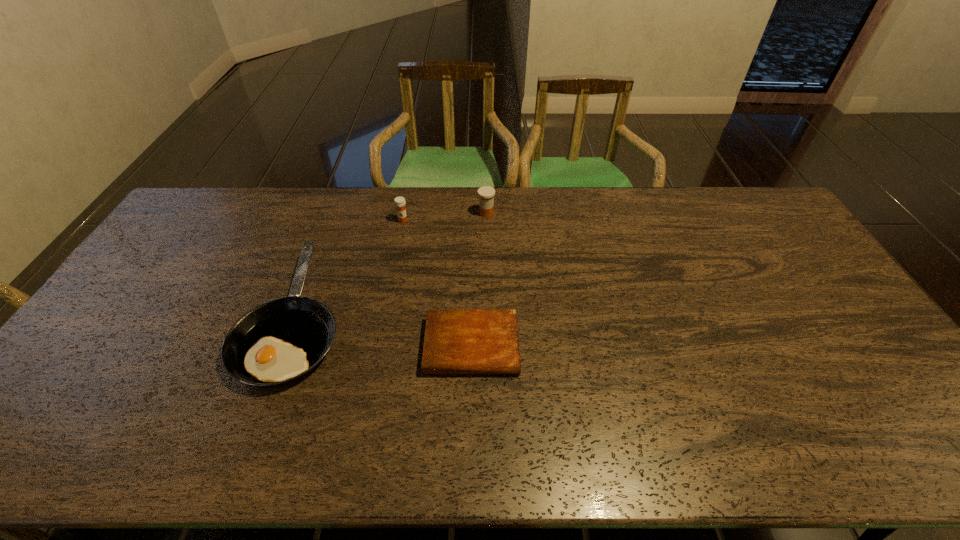
This screenshot has width=960, height=540. In order to click on free space between the second object from left to right and the frying pan in this screenshot , I will do `click(349, 268)`.

Find the location of a particular element. Image resolution: width=960 pixels, height=540 pixels. free space between the third tallest object and the right medicine is located at coordinates (392, 265).

Identify the location of blank region between the third tallest object and the right medicine. This screenshot has width=960, height=540. (392, 265).

Locate an element on the screen. free space between the second object from left to right and the right medicine is located at coordinates (444, 217).

Find the location of a particular element. vacant point located between the right medicine and the Bible is located at coordinates (479, 280).

Where is `vacant area between the leftmost object and the second object from left to right`? This screenshot has width=960, height=540. vacant area between the leftmost object and the second object from left to right is located at coordinates (349, 268).

Identify which object is located as the nearest to the left medicine. Please provide its 2D coordinates. Your answer should be formatted as a tuple, i.e. [(x, y)], where the tuple contains the x and y coordinates of a point satisfying the conditions above.

[(280, 340)]

Select which object is the closest to the right medicine. Please provide its 2D coordinates. Your answer should be formatted as a tuple, i.e. [(x, y)], where the tuple contains the x and y coordinates of a point satisfying the conditions above.

[(400, 202)]

Find the location of a particular element. The height and width of the screenshot is (540, 960). free point that satisfies the following two spatial constraints: 1. on the label of the right medicine; 2. on the front side of the third tallest object is located at coordinates (488, 316).

In order to click on free space that satisfies the following two spatial constraints: 1. on the label of the right medicine; 2. on the label side of the second object from left to right in this screenshot , I will do `click(487, 220)`.